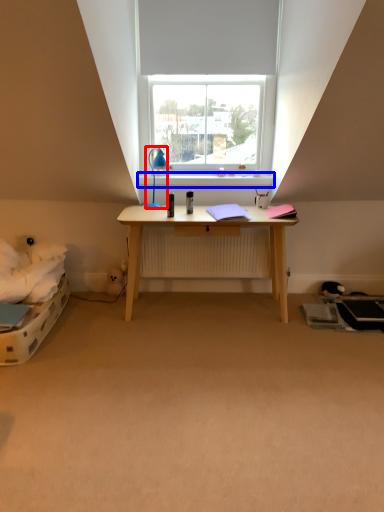
Question: Which of the following is the closest to the observer, lamp (highlighted by a red box) or window sill (highlighted by a blue box)?

Choices:
 (A) lamp
 (B) window sill

Answer: (A)